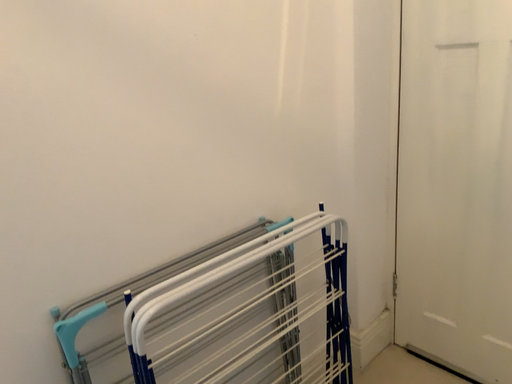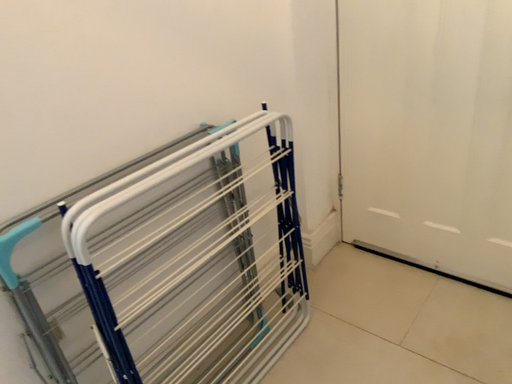
Question: Which way did the camera rotate in the video?

Choices:
 (A) rotated right
 (B) rotated left

Answer: (A)